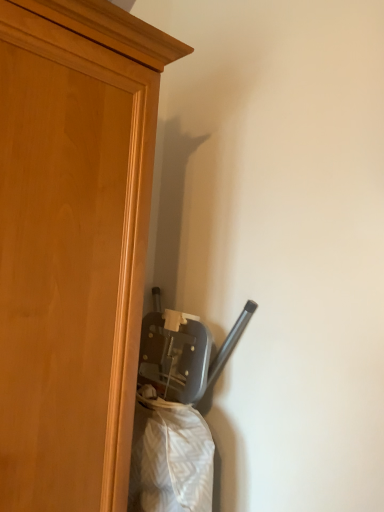
This screenshot has width=384, height=512. What are the coordinates of `metallic gray swivel chair at lower right` in the screenshot? It's located at (175, 413).

What do you see at coordinates (175, 413) in the screenshot? The width and height of the screenshot is (384, 512). I see `metallic gray swivel chair at lower right` at bounding box center [175, 413].

At what (x,y) coordinates should I click in order to perform the action: click on metallic gray swivel chair at lower right. Please return your answer as a coordinate pair (x, y). This screenshot has height=512, width=384. Looking at the image, I should click on (175, 413).